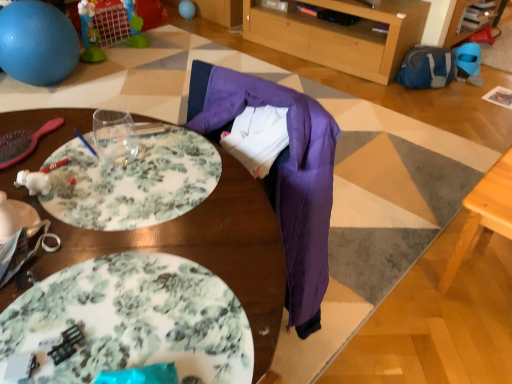
Question: Is blue rubber ball at upper left bigger than white glossy plate at lower left, the 1th plate in the top-to-bottom sequence?

Choices:
 (A) no
 (B) yes

Answer: (B)

Question: Does blue rubber ball at upper left lie in front of white glossy plate at lower left, placed as the 1th plate when sorted from left to right?

Choices:
 (A) yes
 (B) no

Answer: (B)

Question: Can you confirm if blue rubber ball at upper left is shorter than white glossy plate at lower left, placed as the 1th plate when sorted from left to right?

Choices:
 (A) yes
 (B) no

Answer: (B)

Question: From the image's perspective, is blue rubber ball at upper left above white glossy plate at lower left, the 1th plate in the top-to-bottom sequence?

Choices:
 (A) yes
 (B) no

Answer: (A)

Question: Can you confirm if blue rubber ball at upper left is taller than white glossy plate at lower left, the 1th plate in the top-to-bottom sequence?

Choices:
 (A) yes
 (B) no

Answer: (A)

Question: Relative to wooden table at center, which is counted as the first table, starting from the left, is light wood table at lower right, marked as the 2th table in a left-to-right arrangement, in front or behind?

Choices:
 (A) front
 (B) behind

Answer: (B)

Question: Visually, is light wood table at lower right, marked as the 2th table in a left-to-right arrangement, positioned to the left or to the right of wooden table at center, which is counted as the first table, starting from the left?

Choices:
 (A) left
 (B) right

Answer: (B)

Question: Do you think light wood table at lower right, marked as the 2th table in a left-to-right arrangement, is within wooden table at center, which is counted as the first table, starting from the left, or outside of it?

Choices:
 (A) inside
 (B) outside

Answer: (B)

Question: From a real-world perspective, is light wood table at lower right, the 1th table viewed from the right, physically located above or below wooden table at center, which is counted as the first table, starting from the left?

Choices:
 (A) below
 (B) above

Answer: (A)

Question: From a real-world perspective, is light wood table at lower right, the 1th table viewed from the right, above or below matte blue balloon at upper center?

Choices:
 (A) above
 (B) below

Answer: (A)

Question: Is light wood table at lower right, marked as the 2th table in a left-to-right arrangement, to the left or to the right of matte blue balloon at upper center in the image?

Choices:
 (A) left
 (B) right

Answer: (B)

Question: Does point (470, 240) appear closer or farther from the camera than point (190, 9)?

Choices:
 (A) farther
 (B) closer

Answer: (B)

Question: From the image's perspective, is light wood table at lower right, marked as the 2th table in a left-to-right arrangement, positioned above or below matte blue balloon at upper center?

Choices:
 (A) below
 (B) above

Answer: (A)

Question: Which is correct: white glossy plate at lower left, which is counted as the second plate, starting from the right, is inside light wood table at lower right, marked as the 2th table in a left-to-right arrangement, or outside of it?

Choices:
 (A) outside
 (B) inside

Answer: (A)

Question: Considering their positions, is white glossy plate at lower left, marked as the second plate in a bottom-to-top arrangement, located in front of or behind light wood table at lower right, marked as the 2th table in a left-to-right arrangement?

Choices:
 (A) front
 (B) behind

Answer: (A)